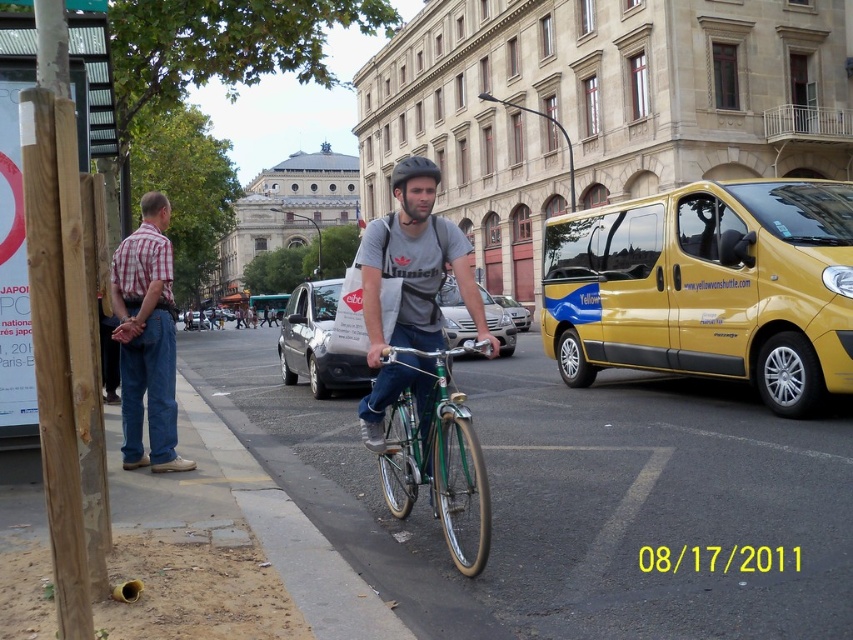
Question: Is yellow metallic van at right bigger than matte gray van at center?

Choices:
 (A) yes
 (B) no

Answer: (B)

Question: Estimate the real-world distances between objects in this image. Which object is closer to the plaid shirt at left?

Choices:
 (A) silver metallic van at center
 (B) matte gray shirt at center
 (C) matte black helmet at center

Answer: (B)

Question: Which point is closer to the camera?

Choices:
 (A) matte gray shirt at center
 (B) matte gray van at center
 (C) yellow metallic van at right

Answer: (B)

Question: Is metallic silver car at center thinner than silver metallic van at center?

Choices:
 (A) no
 (B) yes

Answer: (B)

Question: Estimate the real-world distances between objects in this image. Which object is closer to the matte gray van at center?

Choices:
 (A) yellow metallic van at right
 (B) green metallic bicycle at center
 (C) plaid shirt at left
 (D) silver metallic van at center

Answer: (B)

Question: Is green metallic bicycle at center positioned behind matte gray van at center?

Choices:
 (A) yes
 (B) no

Answer: (B)